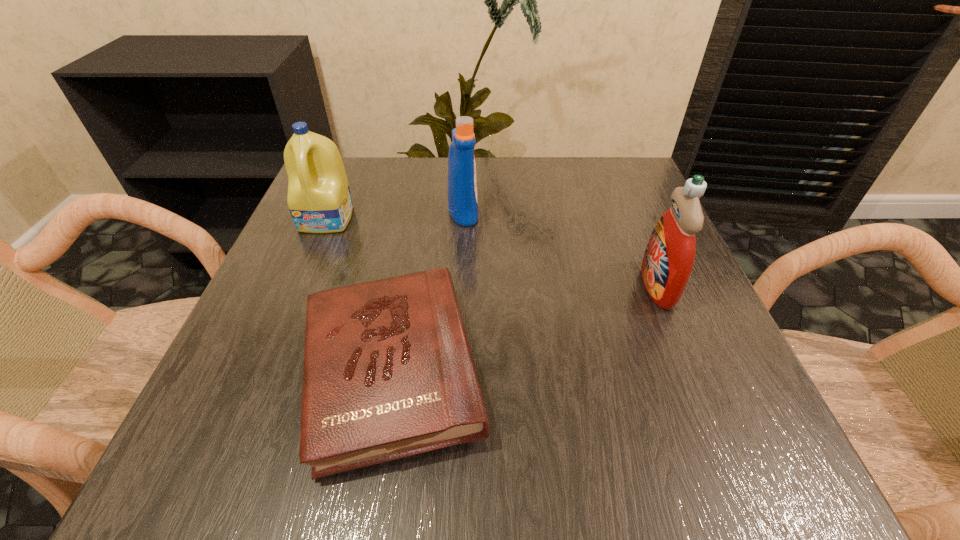
You are a GUI agent. You are given a task and a screenshot of the screen. Output one action in this format:
    pyautogui.click(x=<x>, y=<y>)
    Task: Click on the object that ranks as the closest to the rightmost detergent
    
    Given the screenshot: What is the action you would take?
    pyautogui.click(x=388, y=373)

Where is `detergent that is the third closest to the shortest object`? The height and width of the screenshot is (540, 960). detergent that is the third closest to the shortest object is located at coordinates (668, 260).

The height and width of the screenshot is (540, 960). Identify the location of detergent identified as the second closest to the nearest detergent. (319, 200).

Where is `vacant region that satisfies the following two spatial constraints: 1. on the label of the second detergent from right to left; 2. on the label of the leftmost detergent`? The height and width of the screenshot is (540, 960). vacant region that satisfies the following two spatial constraints: 1. on the label of the second detergent from right to left; 2. on the label of the leftmost detergent is located at coordinates (463, 219).

You are a GUI agent. You are given a task and a screenshot of the screen. Output one action in this format:
    pyautogui.click(x=<x>, y=<y>)
    Task: Click on the free location that satisfies the following two spatial constraints: 1. on the label of the second detergent from left to right; 2. on the label of the leftmost detergent
    
    Given the screenshot: What is the action you would take?
    pyautogui.click(x=463, y=219)